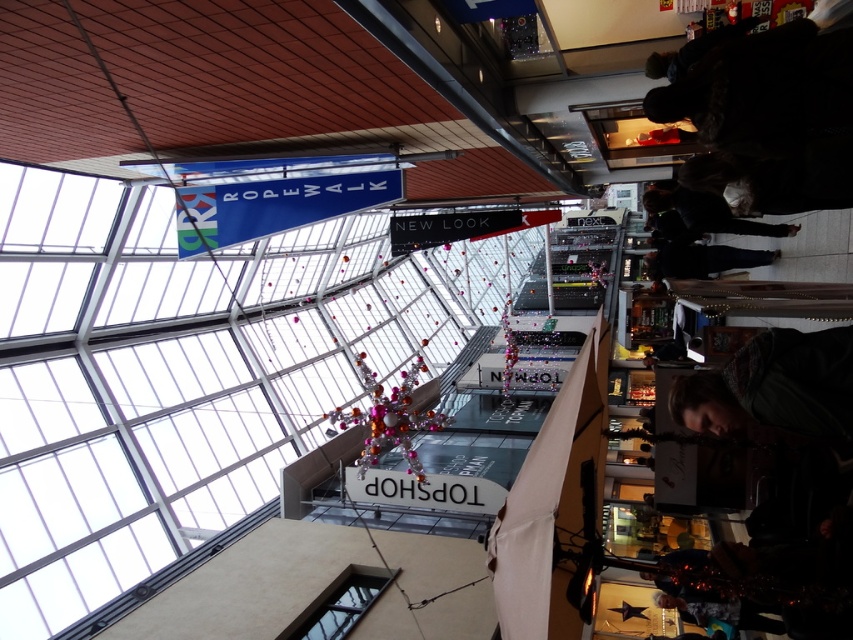
Question: From the image, what is the correct spatial relationship of dark green sweater at lower right in relation to black fabric jacket at center?

Choices:
 (A) below
 (B) above

Answer: (A)

Question: Estimate the real-world distances between objects in this image. Which object is farther from the black fabric jacket at center?

Choices:
 (A) dark brown leather jacket at center
 (B) dark green sweater at lower right

Answer: (B)

Question: Which object is the farthest from the dark brown leather jacket at center?

Choices:
 (A) dark green sweater at lower right
 (B) black fabric jacket at center

Answer: (A)

Question: Based on their relative distances, which object is farther from the dark brown leather jacket at center?

Choices:
 (A) black fabric jacket at center
 (B) dark green sweater at lower right

Answer: (B)

Question: Does dark brown leather jacket at center appear on the left side of black fabric jacket at center?

Choices:
 (A) yes
 (B) no

Answer: (A)

Question: Does dark green sweater at lower right have a lesser width compared to black fabric jacket at center?

Choices:
 (A) no
 (B) yes

Answer: (B)